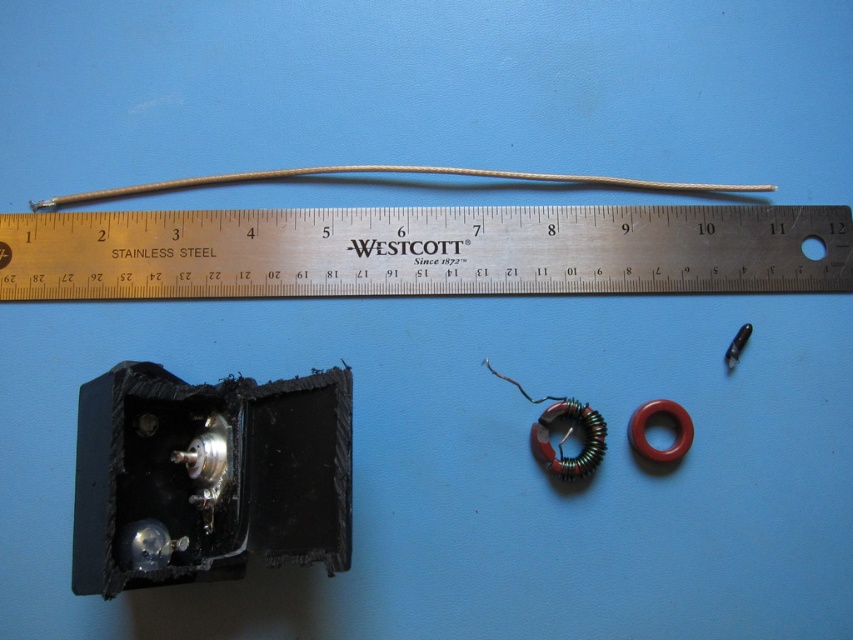
You are an electronics technician working on a circuit board. You need to connect a wire to a component but want to ensure you have enough space. Based on the image provided, is the stainless steel ruler at upper center closer to the right edge of the workspace than the gray matte wire at center?

The stainless steel ruler at upper center is positioned on the right side of gray matte wire at center, so yes, it is closer to the right edge of the workspace than the gray matte wire at center.